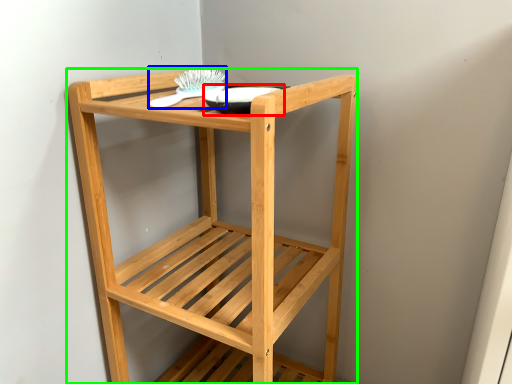
Question: Which is nearer to the glass bowl (highlighted by a red box)? brush (highlighted by a blue box) or furniture (highlighted by a green box).

Choices:
 (A) brush
 (B) furniture

Answer: (A)